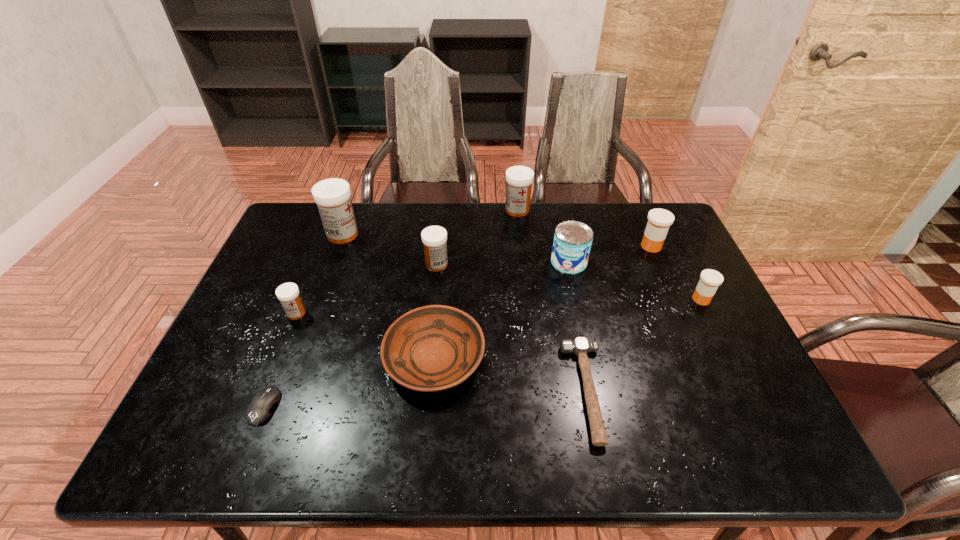
I want to click on the right orange medicine, so click(710, 280).

In order to click on the nearest white medicine in this screenshot , I will do `click(288, 293)`.

Locate an element on the screen. brown plate is located at coordinates (431, 348).

Identify the location of plate. (431, 348).

I want to click on hammer, so click(x=580, y=346).

Locate an element on the screen. The height and width of the screenshot is (540, 960). black computer equipment is located at coordinates (260, 408).

Identify the location of free location located on the back of the tallest medicine. (350, 214).

You are a GUI agent. You are given a task and a screenshot of the screen. Output one action in this format:
    pyautogui.click(x=<x>, y=<y>)
    Task: Click on the free spot located 0.390m on the front of the fourth medicine from left to right
    Image resolution: width=960 pixels, height=540 pixels.
    Given the screenshot: What is the action you would take?
    pyautogui.click(x=527, y=301)

Locate an element on the screen. vacant space located 0.160m on the label of the second object from right to left is located at coordinates (589, 246).

Locate an element on the screen. The width and height of the screenshot is (960, 540). vacant space located 0.270m on the label of the second object from right to left is located at coordinates (555, 246).